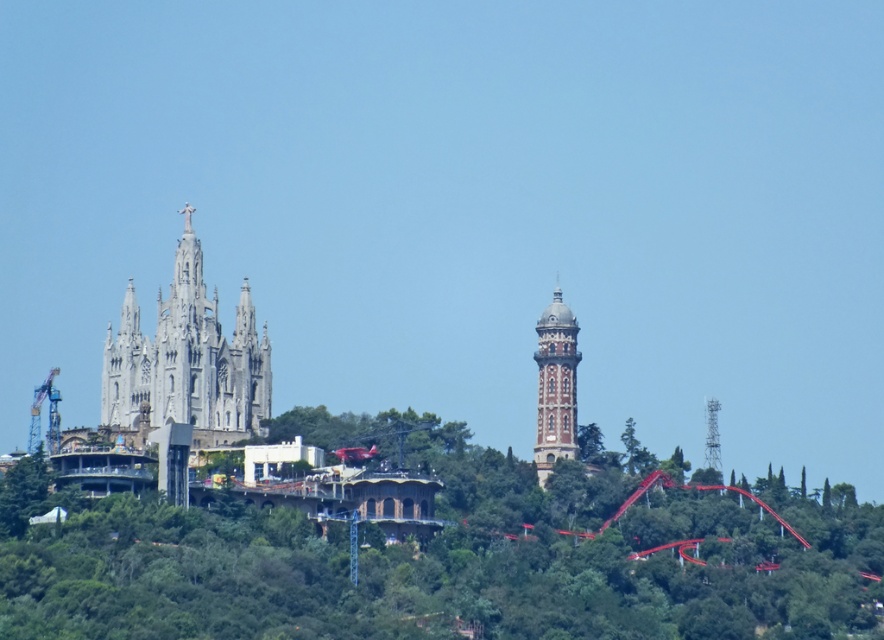
Question: Can you confirm if wooden roller coaster at center is positioned below green leafy tree at center?

Choices:
 (A) yes
 (B) no

Answer: (A)

Question: Can you confirm if wooden roller coaster at center is bigger than brown brick tower at center right?

Choices:
 (A) no
 (B) yes

Answer: (B)

Question: Does wooden roller coaster at center have a lesser width compared to white stone church at left?

Choices:
 (A) yes
 (B) no

Answer: (B)

Question: Which point is closer to the camera taking this photo?

Choices:
 (A) click(537, 417)
 (B) click(124, 333)
 (C) click(634, 429)

Answer: (A)

Question: Based on their relative distances, which object is farther from the brown brick tower at center right?

Choices:
 (A) metallic tower at upper right
 (B) green leafy tree at center
 (C) wooden roller coaster at center

Answer: (A)

Question: Which of the following is the closest to the observer?

Choices:
 (A) white stone church at left
 (B) wooden roller coaster at center
 (C) green leafy tree at center

Answer: (B)